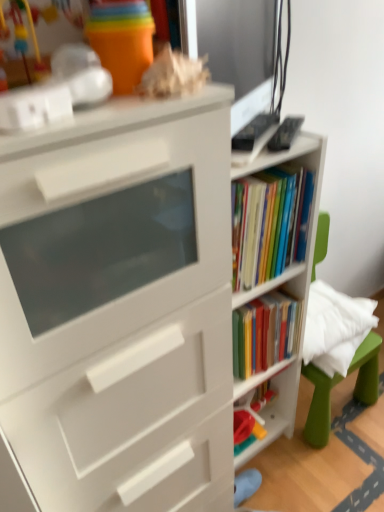
The width and height of the screenshot is (384, 512). I want to click on free space in front of green plastic swivel chair at right, so click(331, 468).